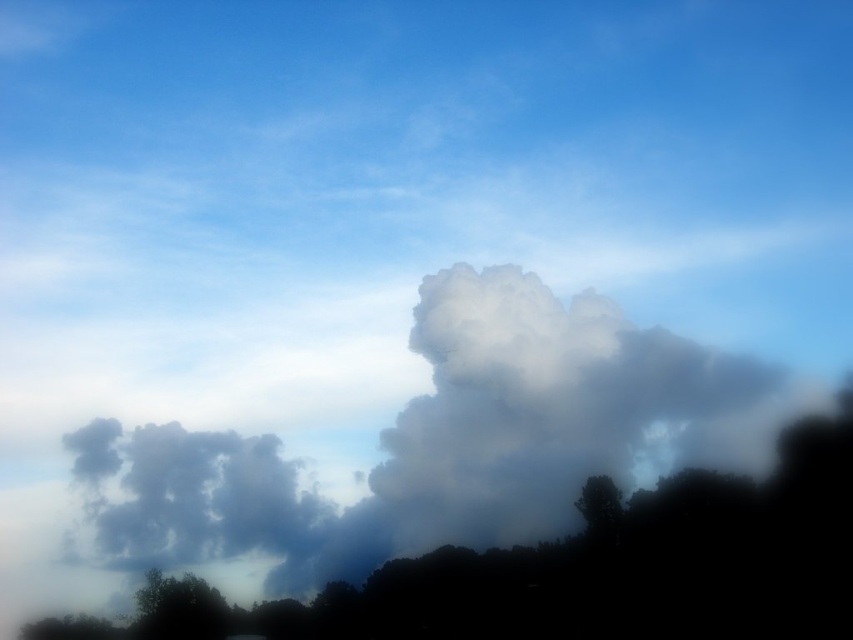
You are an astronomer analyzing the sky image. You need to determine the position of the white fluffy cloud at center relative to the horizon. Is it closer to the top or bottom of the image?

The white fluffy cloud at center is located at point coordinates that are 52.6 percent from the bottom, meaning it is closer to the bottom of the image than the top.

You are a painter setting up an easel to paint the scene. You want to ensure the green leafy tree at lower left and the green matte tree at lower right are proportionally accurate in your painting. Which tree should you paint wider?

You should paint the green leafy tree at lower left wider because its width is larger than the green matte tree at lower right.

You are an artist trying to paint this scene. You want to ensure the white fluffy cloud at center and the green leafy tree at lower left are proportionally accurate. Which object should you make wider in your painting?

The white fluffy cloud at center should be made wider in the painting since its width is larger than the green leafy tree at lower left.